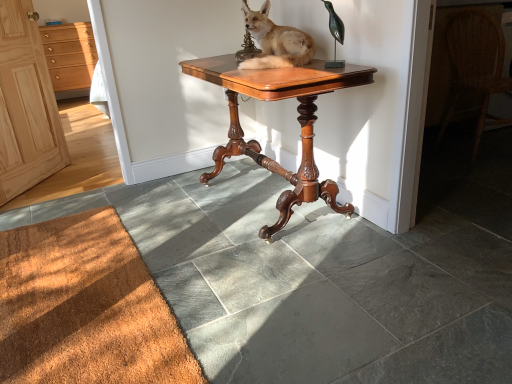
Find the location of a particular element. The width and height of the screenshot is (512, 384). vacant space underneath natural wood cabinet at left (from a real-world perspective) is located at coordinates click(x=35, y=186).